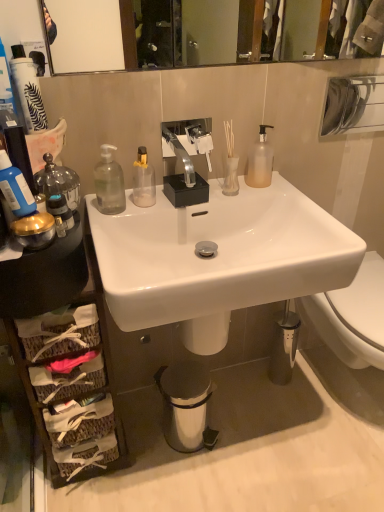
Find the location of a particular element. The width and height of the screenshot is (384, 512). vacant space in front of metallic trash can at lower center is located at coordinates (186, 479).